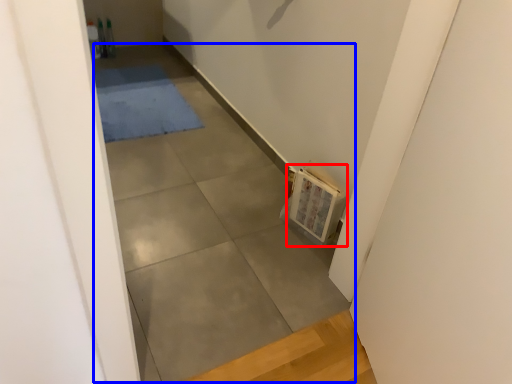
Question: Which point is closer to the camera, book (highlighted by a red box) or concrete (highlighted by a blue box)?

Choices:
 (A) book
 (B) concrete

Answer: (B)